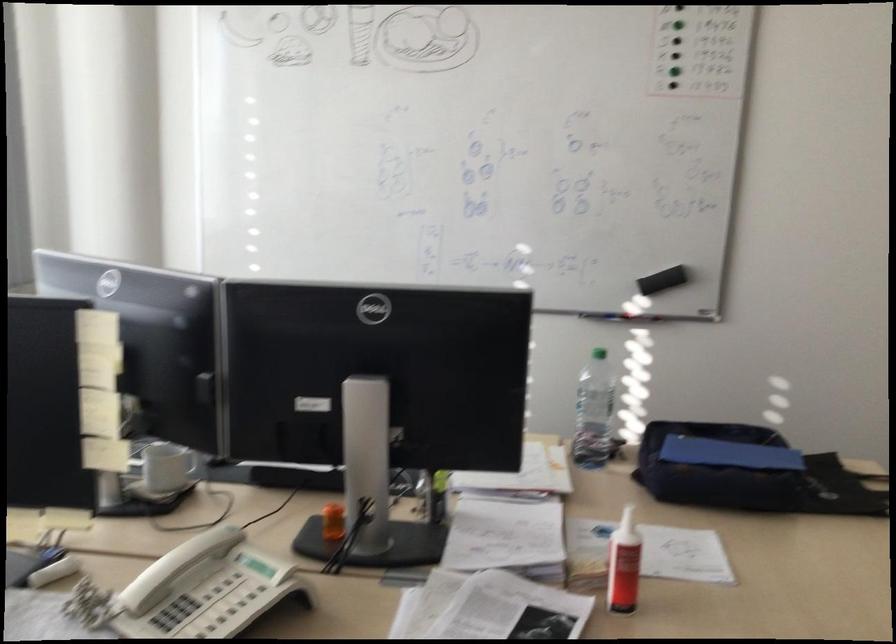
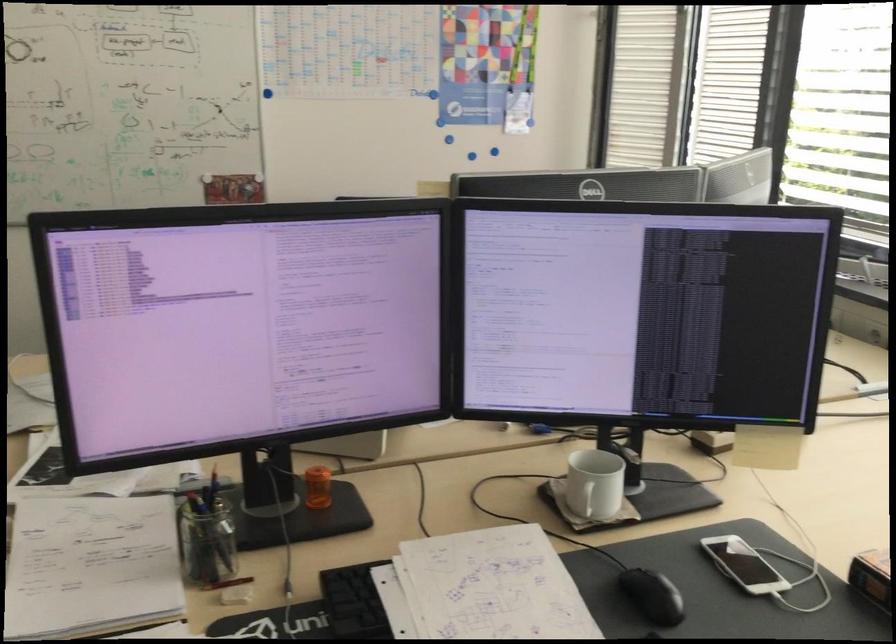
In the second image, find the point that corresponds to the point at 176,460 in the first image.

(583, 498)